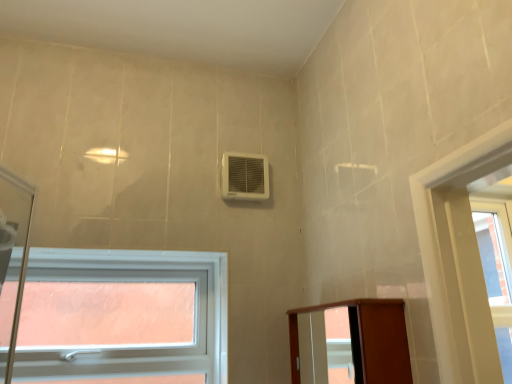
Where is `white plastic air conditioning unit at upper center`? Image resolution: width=512 pixels, height=384 pixels. white plastic air conditioning unit at upper center is located at coordinates (245, 176).

The height and width of the screenshot is (384, 512). In order to click on brown wood elevator at lower right in this screenshot , I will do `click(367, 340)`.

The width and height of the screenshot is (512, 384). I want to click on white plastic air conditioning unit at upper center, so click(x=245, y=176).

Locate an element on the screen. The image size is (512, 384). elevator on the right of white plastic air conditioning unit at upper center is located at coordinates (367, 340).

What's the angular difference between white plastic air conditioning unit at upper center and brown wood elevator at lower right's facing directions?

90.4 degrees separate the facing orientations of white plastic air conditioning unit at upper center and brown wood elevator at lower right.

Is point (259, 175) less distant than point (396, 317)?

That is False.

From the image's perspective, is white plastic air conditioning unit at upper center below brown wood elevator at lower right?

Actually, white plastic air conditioning unit at upper center appears above brown wood elevator at lower right in the image.

How distant is brown wood elevator at lower right from white plastic window at lower left?

brown wood elevator at lower right is 32.68 inches away from white plastic window at lower left.

Is brown wood elevator at lower right smaller than white plastic window at lower left?

Correct, brown wood elevator at lower right occupies less space than white plastic window at lower left.

Between brown wood elevator at lower right and white plastic window at lower left, which one has more height?

Standing taller between the two is white plastic window at lower left.

Can you tell me how much brown wood elevator at lower right and white plastic window at lower left differ in facing direction?

There is a 90.5-degree angle between the facing directions of brown wood elevator at lower right and white plastic window at lower left.

Consider the image. What's the angular difference between brown wood elevator at lower right and white plastic air conditioning unit at upper center's facing directions?

brown wood elevator at lower right and white plastic air conditioning unit at upper center are facing 90.4 degrees away from each other.

Identify the location of air conditioning above the brown wood elevator at lower right (from the image's perspective). Image resolution: width=512 pixels, height=384 pixels. (245, 176).

From a real-world perspective, is brown wood elevator at lower right above or below white plastic air conditioning unit at upper center?

From a real-world perspective, brown wood elevator at lower right is physically below white plastic air conditioning unit at upper center.

Which object is positioned more to the left, brown wood elevator at lower right or white plastic air conditioning unit at upper center?

Positioned to the left is white plastic air conditioning unit at upper center.

Who is taller, white plastic window at lower left or brown wood elevator at lower right?

white plastic window at lower left is taller.

Is white plastic window at lower left spatially inside brown wood elevator at lower right, or outside of it?

white plastic window at lower left is spatially situated outside brown wood elevator at lower right.

Could you tell me if white plastic window at lower left is facing brown wood elevator at lower right?

No, white plastic window at lower left does not turn towards brown wood elevator at lower right.

Considering the positions of objects white plastic window at lower left and brown wood elevator at lower right in the image provided, who is more to the left, white plastic window at lower left or brown wood elevator at lower right?

white plastic window at lower left.

Is white plastic air conditioning unit at upper center oriented away from white plastic window at lower left?

No, white plastic window at lower left is not at the back of white plastic air conditioning unit at upper center.

How many degrees apart are the facing directions of white plastic air conditioning unit at upper center and white plastic window at lower left?

There is a 0.163-degree angle between the facing directions of white plastic air conditioning unit at upper center and white plastic window at lower left.

From the image's perspective, would you say white plastic air conditioning unit at upper center is shown under white plastic window at lower left?

No, from the image's perspective, white plastic air conditioning unit at upper center is not below white plastic window at lower left.

From the image's perspective, who appears lower, white plastic window at lower left or white plastic air conditioning unit at upper center?

white plastic window at lower left appears lower in the image.

What's the angular difference between white plastic window at lower left and white plastic air conditioning unit at upper center's facing directions?

0.163 degrees separate the facing orientations of white plastic window at lower left and white plastic air conditioning unit at upper center.

From a real-world perspective, which is physically below, white plastic window at lower left or white plastic air conditioning unit at upper center?

From a 3D spatial view, white plastic window at lower left is below.

Does white plastic window at lower left appear on the right side of white plastic air conditioning unit at upper center?

Incorrect, white plastic window at lower left is not on the right side of white plastic air conditioning unit at upper center.

At what (x,y) coordinates should I click in order to perform the action: click on elevator below the white plastic air conditioning unit at upper center (from a real-world perspective). Please return your answer as a coordinate pair (x, y). The image size is (512, 384). Looking at the image, I should click on (367, 340).

Where is `window located on the left of brown wood elevator at lower right`? The image size is (512, 384). window located on the left of brown wood elevator at lower right is located at coordinates (135, 346).

Looking at the image, which one is located closer to white plastic air conditioning unit at upper center, brown wood elevator at lower right or white plastic window at lower left?

white plastic window at lower left.

When comparing their distances from white plastic window at lower left, does brown wood elevator at lower right or white plastic air conditioning unit at upper center seem closer?

white plastic air conditioning unit at upper center.

Which object lies further to the anchor point brown wood elevator at lower right, white plastic air conditioning unit at upper center or white plastic window at lower left?

white plastic window at lower left lies further to brown wood elevator at lower right than the other object.

Considering their positions, is white plastic air conditioning unit at upper center positioned further to white plastic window at lower left than brown wood elevator at lower right?

brown wood elevator at lower right is further to white plastic window at lower left.

When comparing their distances from brown wood elevator at lower right, does white plastic window at lower left or white plastic air conditioning unit at upper center seem closer?

The object closer to brown wood elevator at lower right is white plastic air conditioning unit at upper center.

Estimate the real-world distances between objects in this image. Which object is further from white plastic air conditioning unit at upper center, white plastic window at lower left or brown wood elevator at lower right?

brown wood elevator at lower right is further to white plastic air conditioning unit at upper center.

At what (x,y) coordinates should I click in order to perform the action: click on air conditioning between white plastic window at lower left and brown wood elevator at lower right. Please return your answer as a coordinate pair (x, y). Looking at the image, I should click on (245, 176).